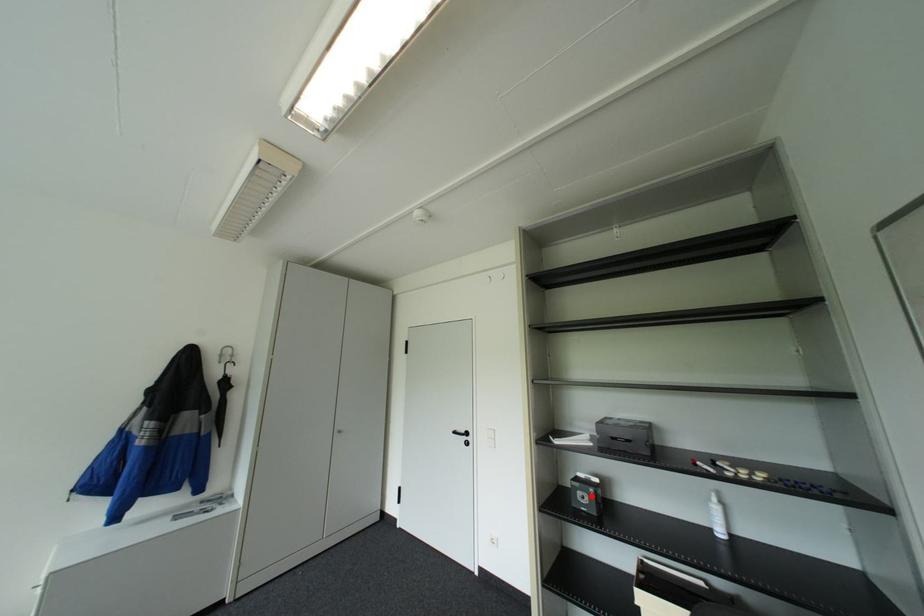
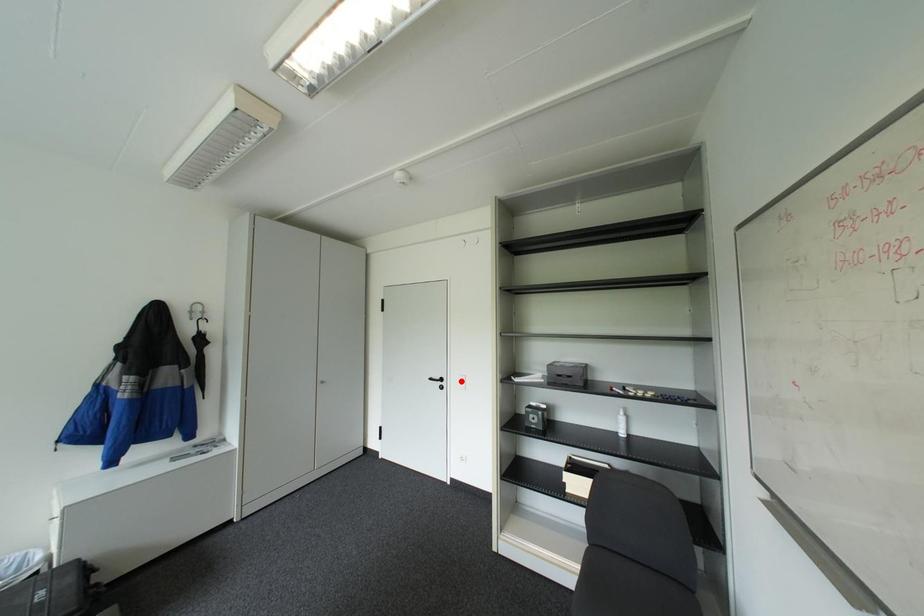
I am providing you with two images of the same scene from different viewpoints. A red point is marked on the first image and another point is marked on the second image. Are the points marked in image1 and image2 representing the same 3D position?

No